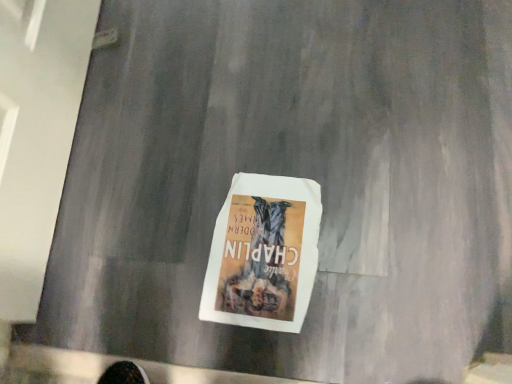
This screenshot has height=384, width=512. I want to click on vacant space behind white paper at center, so [x=223, y=151].